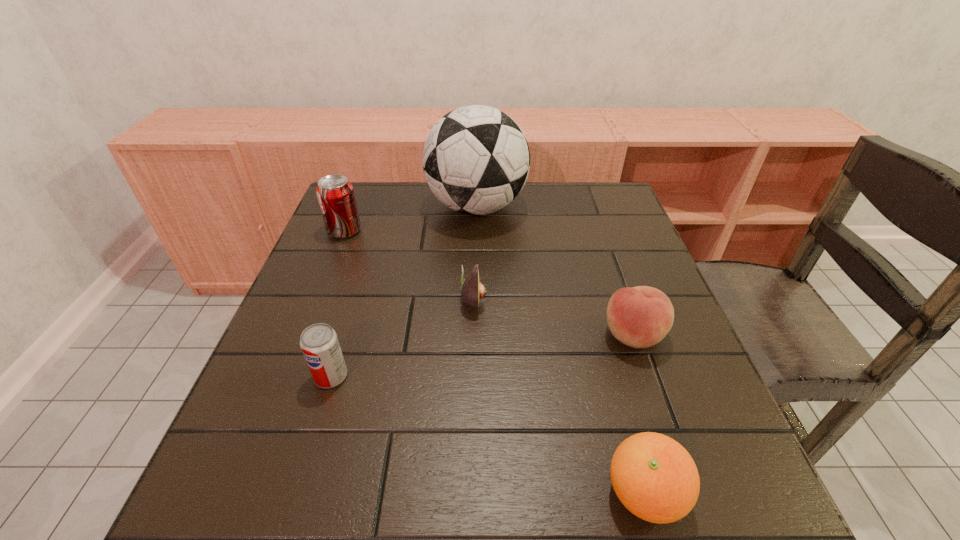
The height and width of the screenshot is (540, 960). What are the coordinates of `free point that satisfies the following two spatial constraints: 1. on the front side of the nearer soda; 2. on the left side of the second tallest object` in the screenshot? It's located at (286, 376).

Find the location of a particular element. free space that satisfies the following two spatial constraints: 1. on the seed side of the nearest object; 2. on the right side of the avocado is located at coordinates (471, 494).

The image size is (960, 540). Identify the location of free spot that satisfies the following two spatial constraints: 1. on the back side of the orange; 2. on the surface of the soccer ball where the brand logo is visible. point(566,207).